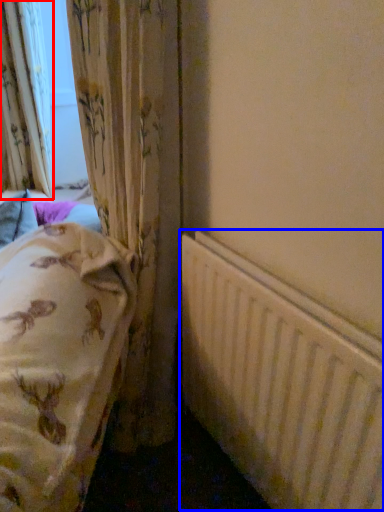
Question: Which object is closer to the camera taking this photo, curtain (highlighted by a red box) or radiator (highlighted by a blue box)?

Choices:
 (A) curtain
 (B) radiator

Answer: (B)